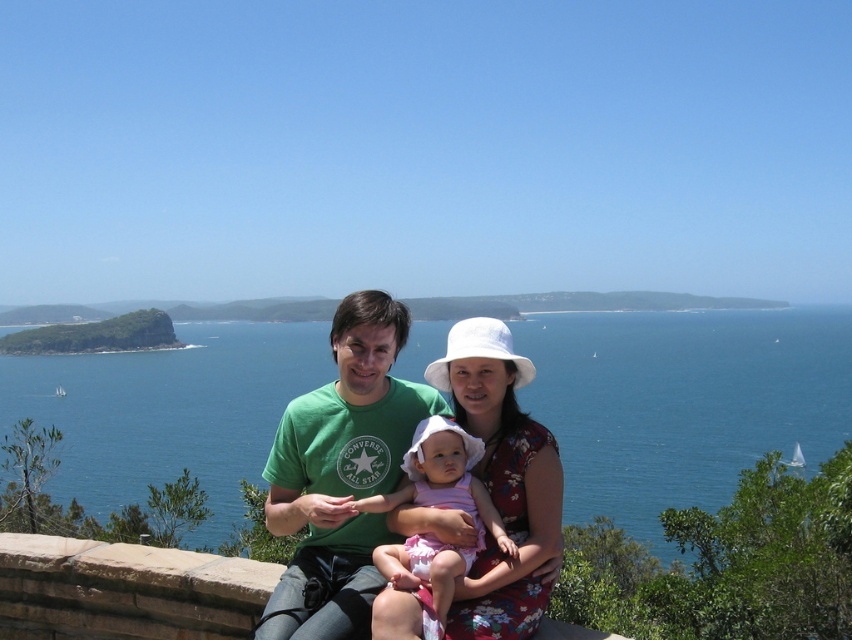
Question: Does blue water at center appear on the left side of floral fabric dress at center?

Choices:
 (A) yes
 (B) no

Answer: (A)

Question: Is floral fabric dress at center below pink fabric dress at center?

Choices:
 (A) yes
 (B) no

Answer: (B)

Question: Which point is closer to the camera?

Choices:
 (A) (440, 592)
 (B) (462, 410)
 (C) (58, 483)
 (D) (335, 332)

Answer: (A)

Question: Which of these objects is positioned farthest from the blue water at center?

Choices:
 (A) green cotton t-shirt at center
 (B) pink fabric dress at center

Answer: (A)

Question: Does blue water at center come behind floral fabric dress at center?

Choices:
 (A) yes
 (B) no

Answer: (A)

Question: Which point is closer to the camera?

Choices:
 (A) green cotton t-shirt at center
 (B) floral fabric dress at center

Answer: (A)